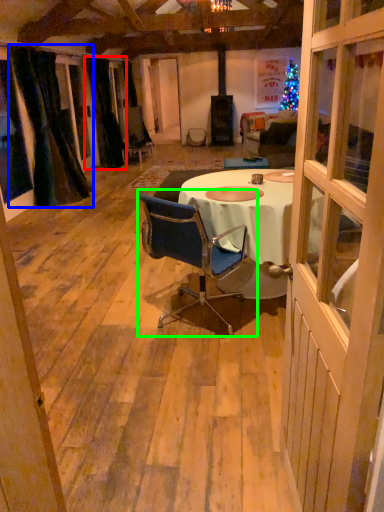
Question: Which is farther away from curtain (highlighted by a red box)? curtain (highlighted by a blue box) or chair (highlighted by a green box)?

Choices:
 (A) curtain
 (B) chair

Answer: (B)